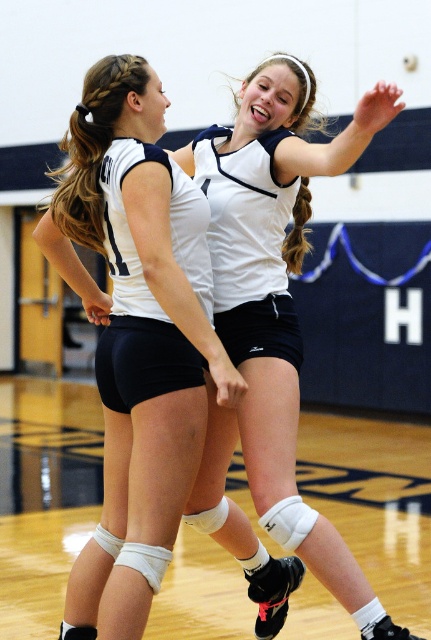
You are a photographer positioned at the back of the volleyball court. You want to capture a photo of both the white matte volleyball jersey at center and the white matte volleyball at center. Which object should you focus on first if you want to ensure both are in the frame?

The white matte volleyball jersey at center is located above the white matte volleyball at center, so you should focus on the white matte volleyball at center first to ensure both are in the frame.

Consider the image. You are a photographer positioned at the back of the volleyball court. You want to capture a photo where the white matte volleyball jersey at center and the white matte volleyball at center are both visible. Which object should you focus on first to ensure both are in frame?

The white matte volleyball jersey at center is to the left of the white matte volleyball at center. Therefore, you should focus on the white matte volleyball jersey at center first to ensure both are in frame since it is positioned to the left of the volleyball.